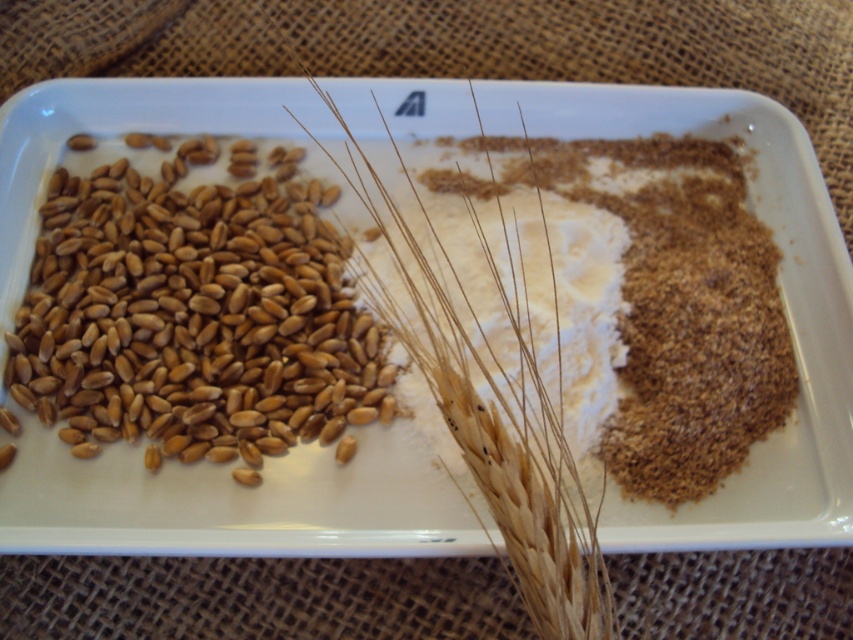
From the picture: Between golden matte wheat grains at left and brown matte barley at center, which one has less height?

golden matte wheat grains at left

Which is behind, point (166, 259) or point (457, 320)?

The point (166, 259) is behind.

The image size is (853, 640). I want to click on golden matte wheat grains at left, so click(x=195, y=316).

This screenshot has width=853, height=640. Identify the location of golden matte wheat grains at left. (195, 316).

Does white powdery at center appear over brown matte barley at center?

Incorrect, white powdery at center is not positioned above brown matte barley at center.

Can you confirm if white powdery at center is wider than brown matte barley at center?

Incorrect, white powdery at center's width does not surpass brown matte barley at center's.

Where is `white powdery at center`? The image size is (853, 640). white powdery at center is located at coordinates (509, 300).

Does brown matte wheat at upper left appear on the left side of white powdery at center?

Correct, you'll find brown matte wheat at upper left to the left of white powdery at center.

Find the location of a particular element. brown matte wheat at upper left is located at coordinates (782, 296).